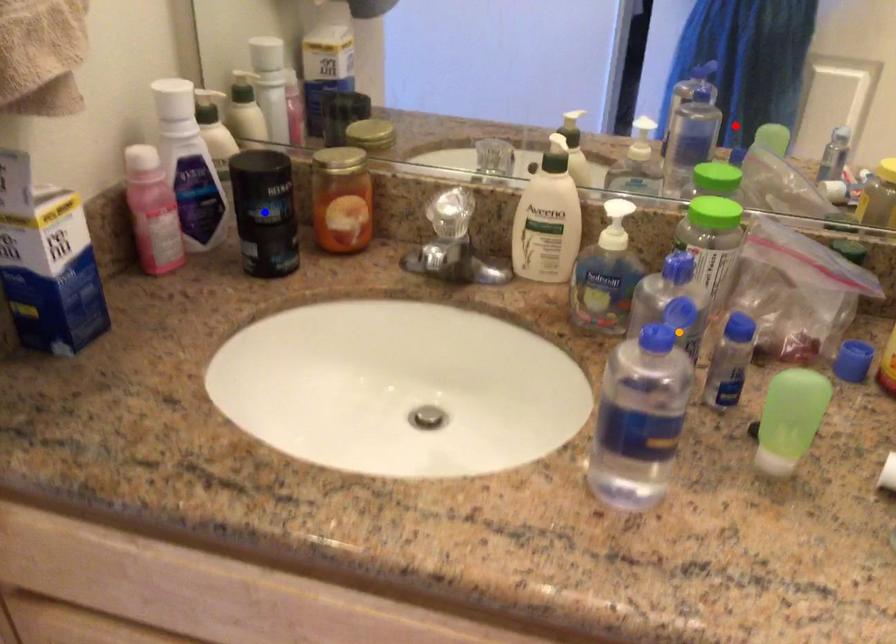
Order these from nearest to farthest:
1. orange point
2. blue point
3. red point

orange point, blue point, red point